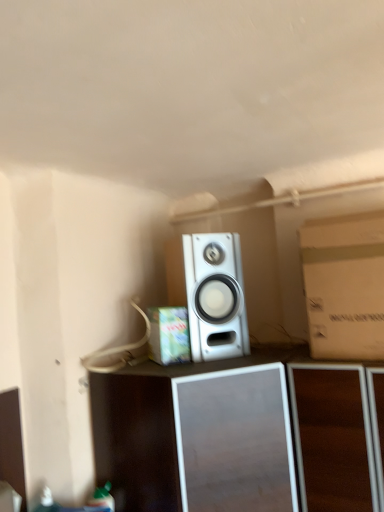
Question: Is brown cardboard box at right, the first cardboard box from the right, bigger than silver metallic speaker at center?

Choices:
 (A) yes
 (B) no

Answer: (A)

Question: Does brown cardboard box at right, the first cardboard box from the right, contain silver metallic speaker at center?

Choices:
 (A) yes
 (B) no

Answer: (B)

Question: Is brown cardboard box at right, arranged as the 2th cardboard box when viewed from the left, behind silver metallic speaker at center?

Choices:
 (A) no
 (B) yes

Answer: (A)

Question: From the image's perspective, does brown cardboard box at right, arranged as the 2th cardboard box when viewed from the left, appear higher than silver metallic speaker at center?

Choices:
 (A) no
 (B) yes

Answer: (B)

Question: Are brown cardboard box at right, arranged as the 2th cardboard box when viewed from the left, and silver metallic speaker at center making contact?

Choices:
 (A) no
 (B) yes

Answer: (A)

Question: Considering the relative sizes of brown cardboard box at right, the first cardboard box from the right, and silver metallic speaker at center in the image provided, is brown cardboard box at right, the first cardboard box from the right, smaller than silver metallic speaker at center?

Choices:
 (A) no
 (B) yes

Answer: (A)

Question: Does brown cardboard box at right, arranged as the 2th cardboard box when viewed from the left, have a lesser width compared to cardboard box at center, placed as the second cardboard box when sorted from right to left?

Choices:
 (A) yes
 (B) no

Answer: (B)

Question: Is cardboard box at center, placed as the second cardboard box when sorted from right to left, at the back of brown cardboard box at right, the first cardboard box from the right?

Choices:
 (A) yes
 (B) no

Answer: (B)

Question: Would you say brown cardboard box at right, the first cardboard box from the right, contains cardboard box at center, the first cardboard box viewed from the left?

Choices:
 (A) no
 (B) yes

Answer: (A)

Question: Is there a large distance between brown cardboard box at right, the first cardboard box from the right, and cardboard box at center, placed as the second cardboard box when sorted from right to left?

Choices:
 (A) yes
 (B) no

Answer: (B)

Question: From the image's perspective, is brown cardboard box at right, the first cardboard box from the right, under cardboard box at center, placed as the second cardboard box when sorted from right to left?

Choices:
 (A) yes
 (B) no

Answer: (B)

Question: Is brown cardboard box at right, arranged as the 2th cardboard box when viewed from the left, next to cardboard box at center, placed as the second cardboard box when sorted from right to left, and touching it?

Choices:
 (A) yes
 (B) no

Answer: (B)

Question: Is cardboard box at center, the first cardboard box viewed from the left, in contact with brown cardboard box at right, the first cardboard box from the right?

Choices:
 (A) no
 (B) yes

Answer: (A)